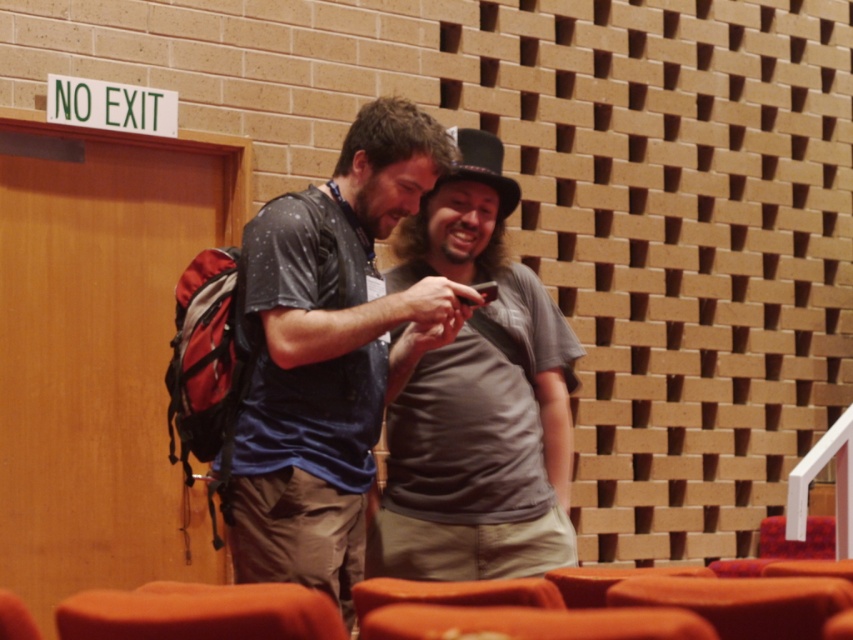
Between point (337, 536) and point (527, 380), which one is positioned behind?

The point (527, 380) is more distant.

Can you confirm if matte blue shirt at center is bigger than gray cotton shirt at center?

Yes, matte blue shirt at center is bigger than gray cotton shirt at center.

Does point (292, 328) come in front of point (444, 492)?

Yes, point (292, 328) is in front of point (444, 492).

Locate an element on the screen. This screenshot has width=853, height=640. matte blue shirt at center is located at coordinates pos(329,353).

Is gray cotton shirt at center above orange fabric chair at lower left?

Yes, gray cotton shirt at center is above orange fabric chair at lower left.

Who is taller, gray cotton shirt at center or orange fabric chair at lower left?

With more height is gray cotton shirt at center.

Does point (461, 349) come farther from viewer compared to point (254, 628)?

Yes, point (461, 349) is behind point (254, 628).

This screenshot has width=853, height=640. Identify the location of gray cotton shirt at center. (477, 401).

The image size is (853, 640). Identify the location of matte blue shirt at center. (329, 353).

The width and height of the screenshot is (853, 640). Find the location of `matte blue shirt at center`. matte blue shirt at center is located at coordinates (329, 353).

Locate an element on the screen. The width and height of the screenshot is (853, 640). matte blue shirt at center is located at coordinates pyautogui.click(x=329, y=353).